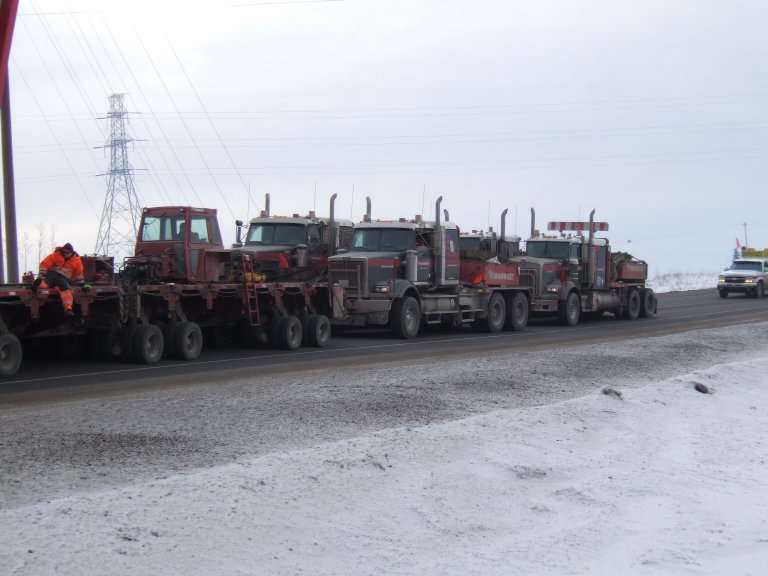
Identify the location of hood. (247, 251), (368, 256), (540, 267).